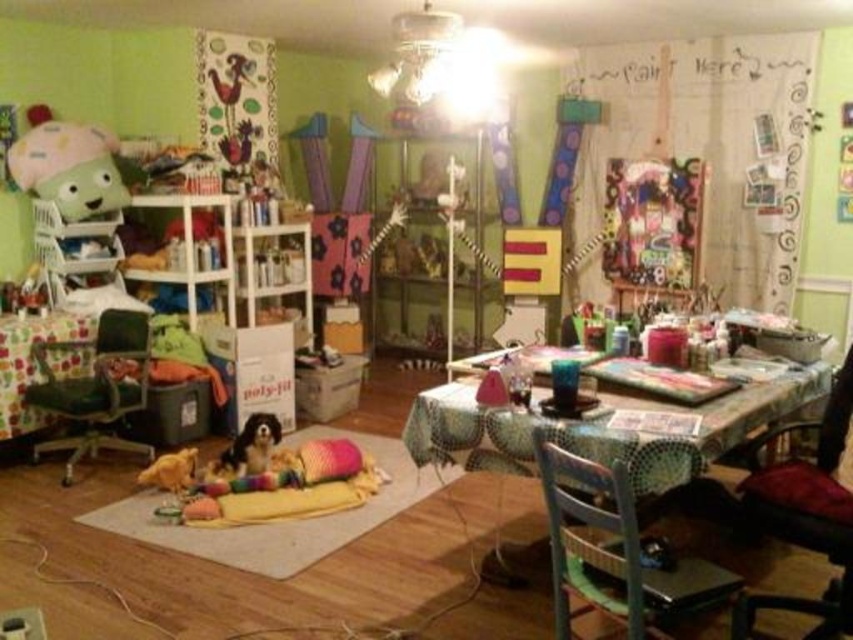
You are trying to decide which chair to use for a child who is 3 feet tall. The wooden chair at lower right and the green fabric office chair at left are options. Which chair is more suitable based on their heights?

The wooden chair at lower right is shorter than the green fabric office chair at left, so the wooden chair at lower right is more suitable for a child who is 3 feet tall.